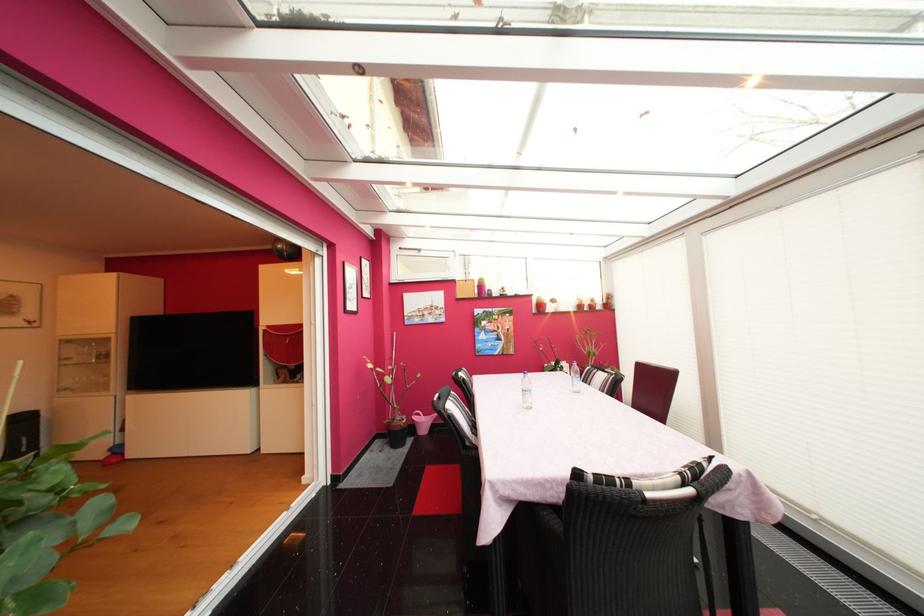
Identify the location of skylight window latch. (417, 249).